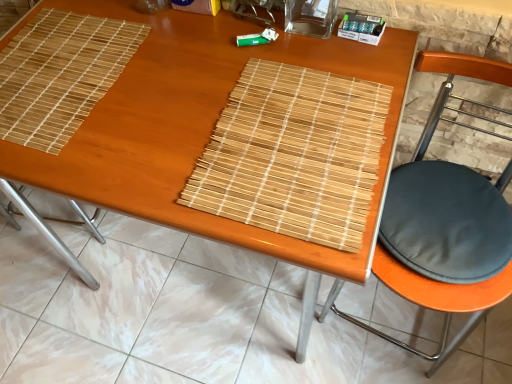
Locate an element on the screen. Image resolution: width=512 pixels, height=384 pixels. free location to the right of natural wood mat at upper left, which is counted as the 1th mat, starting from the left is located at coordinates (174, 76).